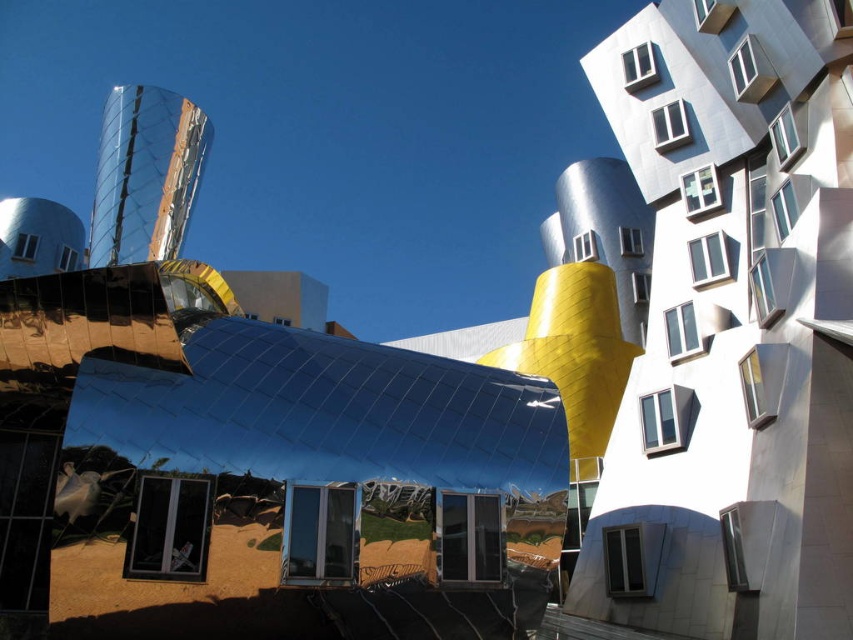
Question: From the image, what is the correct spatial relationship of metallic silver building at center in relation to matte glass window at center?

Choices:
 (A) above
 (B) below

Answer: (A)

Question: Among these points, which one is farthest from the camera?

Choices:
 (A) (717, 625)
 (B) (138, 538)

Answer: (A)

Question: Is metallic silver building at center further to camera compared to matte glass window at center?

Choices:
 (A) no
 (B) yes

Answer: (A)

Question: Among these objects, which one is nearest to the camera?

Choices:
 (A) matte glass window at center
 (B) metallic silver building at center

Answer: (B)

Question: Can you confirm if metallic silver building at center is positioned to the left of matte glass window at center?

Choices:
 (A) no
 (B) yes

Answer: (A)